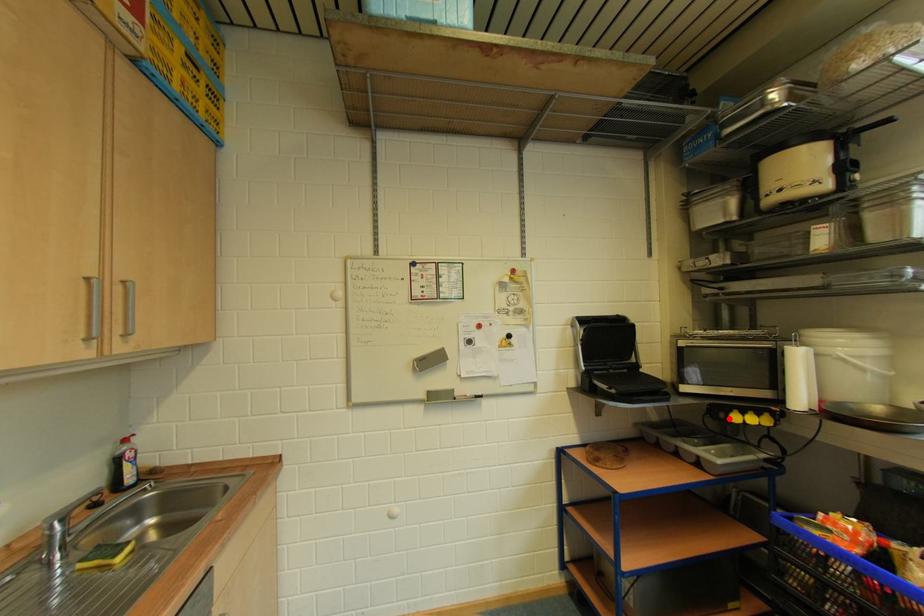
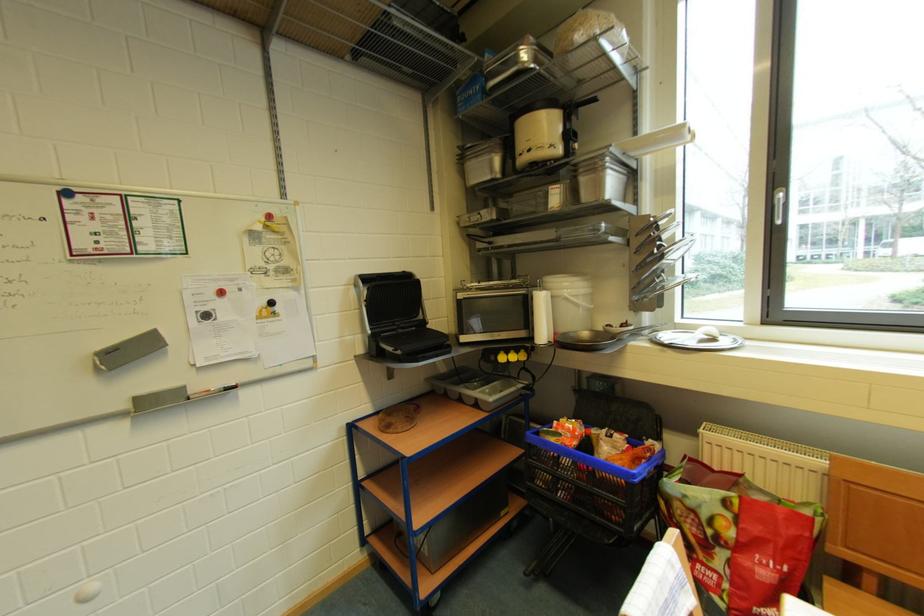
The point at the highlighted location is marked in the first image. Where is the corresponding point in the second image?

(500, 361)